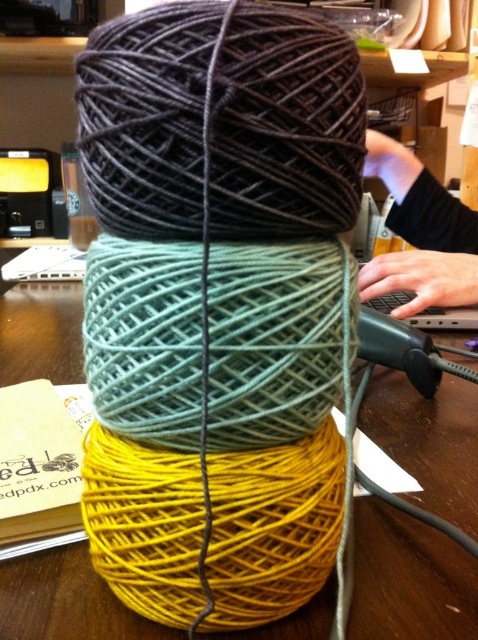
You are a photographer adjusting your camera to focus on two points in the image. The first point is labeled as point (1, 284) and the second is point (442, 221). Since the photographer wants to capture both points clearly, which point should be focused on first to ensure the other is also in focus?

Point (1, 284) is further to the camera than point (442, 221). To ensure both points are in focus, the photographer should focus on the closer point first, which is point (1, 284), and adjust the depth of field accordingly.

You are an artisan preparing to create a craft project. You have a yellow matte yarn at center and a black fabric at upper right. Which material do you think has a greater width, and why?

Result: The yellow matte yarn at center might be wider than the black fabric at upper right according to the description.